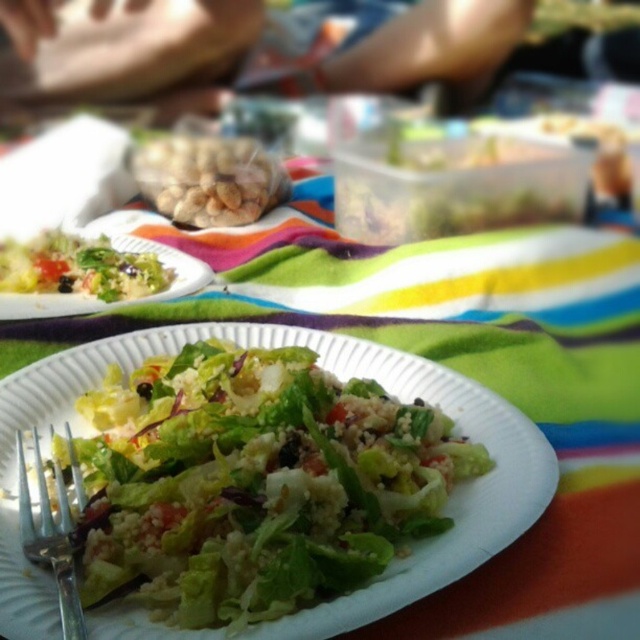
Does point (262, 173) lie behind point (52, 308)?

Yes, it is behind point (52, 308).

Is translucent plastic bag of nuts at center taller than green leafy salad at left?

Indeed, translucent plastic bag of nuts at center has a greater height compared to green leafy salad at left.

Is point (156, 204) positioned before point (88, 301)?

No.

Find the location of `translucent plastic bag of nuts at center`. translucent plastic bag of nuts at center is located at coordinates (209, 179).

Is point (45, 536) farther from viewer compared to point (161, 244)?

No, it is not.

Between silver metallic fork at lower left and green leafy salad at left, which one has less height?

Standing shorter between the two is silver metallic fork at lower left.

You are a GUI agent. You are given a task and a screenshot of the screen. Output one action in this format:
    pyautogui.click(x=<x>, y=<y>)
    Task: Click on the silver metallic fork at lower left
    
    Given the screenshot: What is the action you would take?
    pyautogui.click(x=51, y=536)

Can you confirm if translucent plastic bag of nuts at center is positioned above silver metallic fork at lower left?

Correct, translucent plastic bag of nuts at center is located above silver metallic fork at lower left.

Who is more forward, (x=220, y=156) or (x=35, y=556)?

Point (x=35, y=556) is in front.

Describe the element at coordinates (209, 179) in the screenshot. The width and height of the screenshot is (640, 640). I see `translucent plastic bag of nuts at center` at that location.

This screenshot has height=640, width=640. In order to click on translucent plastic bag of nuts at center in this screenshot , I will do `click(209, 179)`.